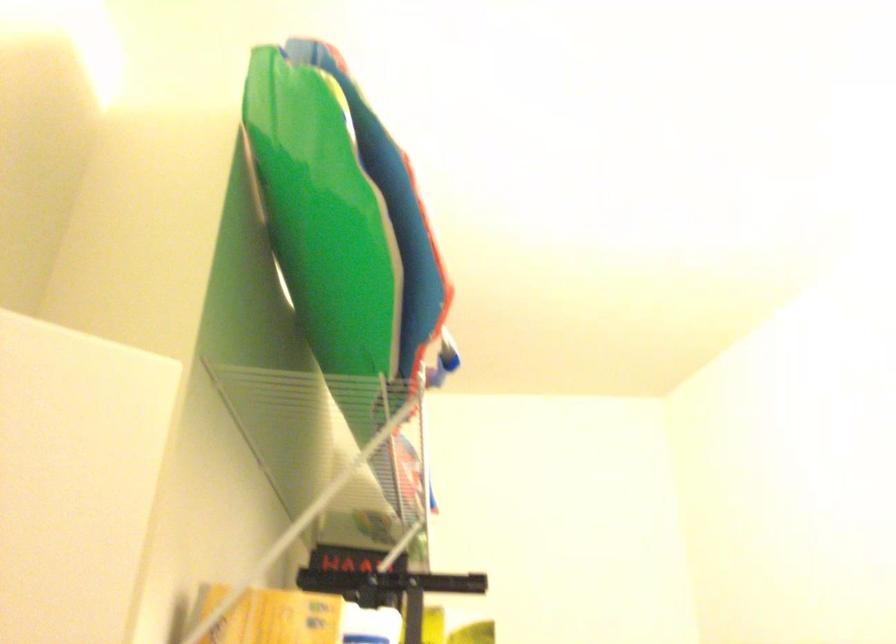
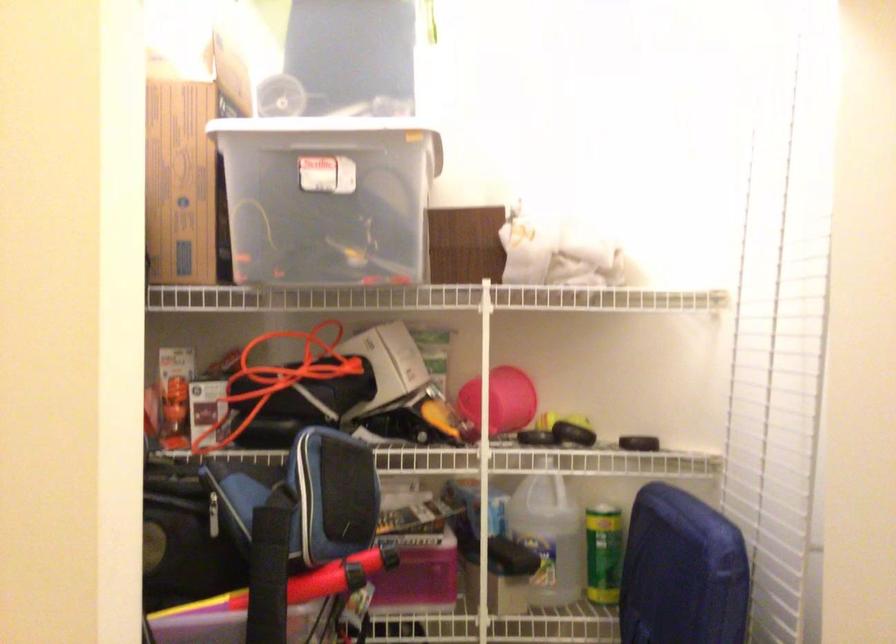
Question: How did the camera likely rotate?

Choices:
 (A) Left
 (B) Right
 (C) Up
 (D) Down

Answer: (A)